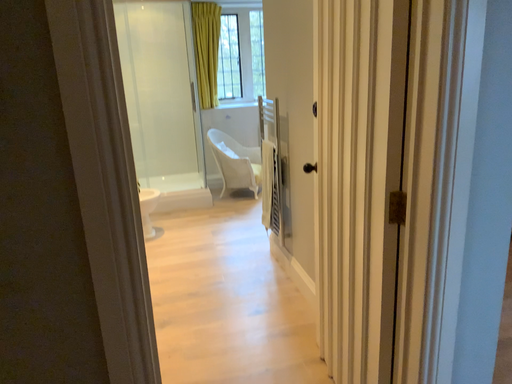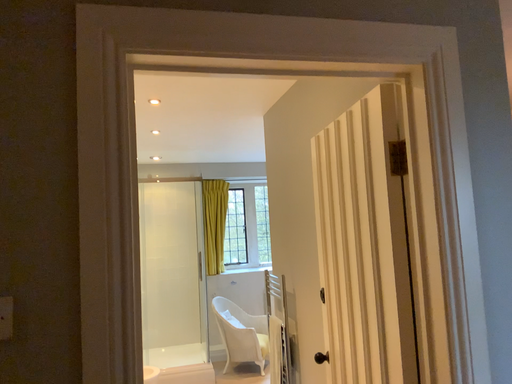
Question: Which way did the camera rotate in the video?

Choices:
 (A) rotated downward
 (B) rotated upward

Answer: (B)